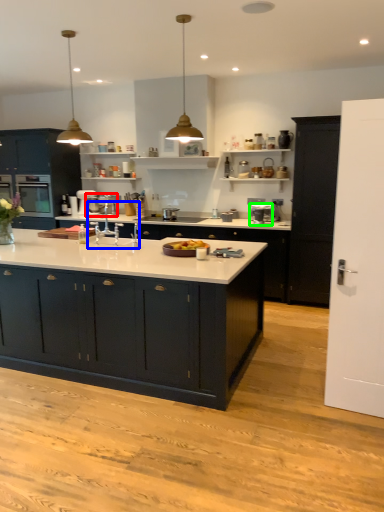
Question: Considering the real-world distances, which object is farthest from appliance (highlighted by a red box)? sink (highlighted by a blue box) or appliance (highlighted by a green box)?

Choices:
 (A) sink
 (B) appliance

Answer: (B)